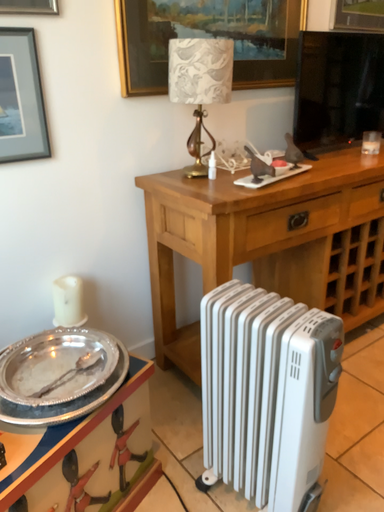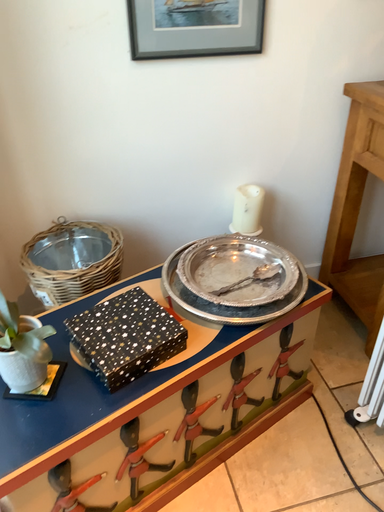
Question: Which way did the camera rotate in the video?

Choices:
 (A) rotated upward
 (B) rotated downward

Answer: (B)